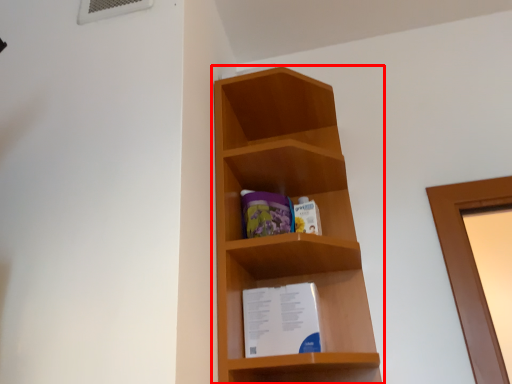
Question: Considering the relative positions of shelf (annotated by the red box) and paperback book in the image provided, where is shelf (annotated by the red box) located with respect to the staircase?

Choices:
 (A) left
 (B) right

Answer: (A)